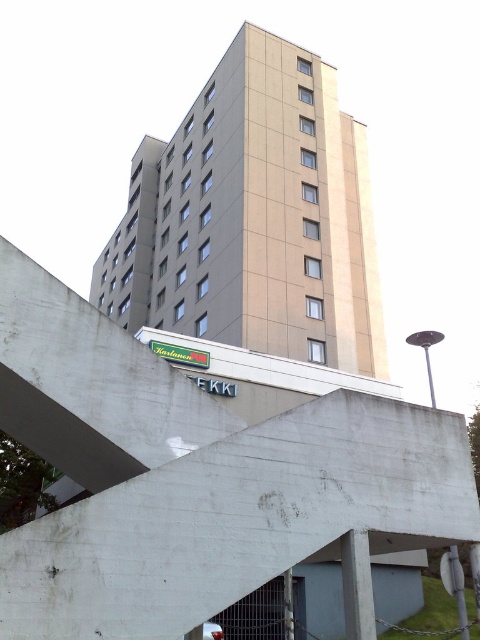
Question: Which object appears farthest from the camera in this image?

Choices:
 (A) concrete at center
 (B) beige concrete building at center

Answer: (B)

Question: From the image, what is the correct spatial relationship of concrete at center in relation to beige concrete building at center?

Choices:
 (A) right
 (B) left

Answer: (A)

Question: Can you confirm if concrete at center is positioned to the left of beige concrete building at center?

Choices:
 (A) no
 (B) yes

Answer: (A)

Question: Can you confirm if concrete at center is bigger than beige concrete building at center?

Choices:
 (A) no
 (B) yes

Answer: (A)